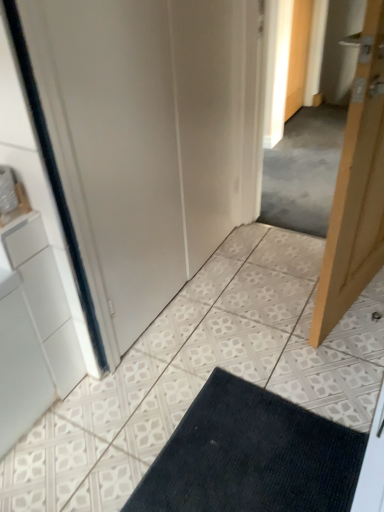
Question: In the image, is white matte door at center on the left side or the right side of wooden door at upper right, which is counted as the 2th door, starting from the front?

Choices:
 (A) left
 (B) right

Answer: (A)

Question: From their relative heights in the image, would you say white matte door at center is taller or shorter than wooden door at upper right, which is the 2th door in bottom-to-top order?

Choices:
 (A) short
 (B) tall

Answer: (B)

Question: Which object is positioned closest to the white matte door at center?

Choices:
 (A) dark blue textured bath mat at lower center
 (B) light wood door at right, placed as the 2th door when sorted from back to front
 (C) wooden door at upper right, which is counted as the 2th door, starting from the front

Answer: (B)

Question: Which object is positioned farthest from the wooden door at upper right, which is the 2th door in bottom-to-top order?

Choices:
 (A) dark blue textured bath mat at lower center
 (B) light wood door at right, acting as the first door starting from the front
 (C) white matte door at center

Answer: (A)